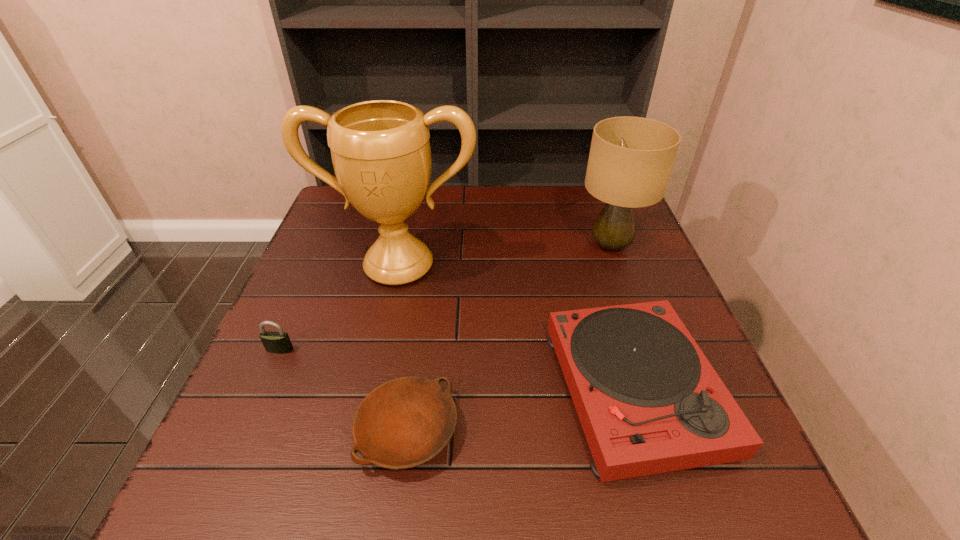
Image resolution: width=960 pixels, height=540 pixels. Identify the location of vacant space at the near edge of the desktop. (559, 511).

In the image, there is a desktop. Where is `blank space at the left edge`? The height and width of the screenshot is (540, 960). blank space at the left edge is located at coordinates (287, 382).

Locate an element on the screen. vacant area at the right edge is located at coordinates pyautogui.click(x=654, y=267).

You are a GUI agent. You are given a task and a screenshot of the screen. Output one action in this format:
    pyautogui.click(x=<x>, y=<y>)
    Task: Click on the vacant point at the far left corner
    This screenshot has height=540, width=960.
    Given the screenshot: What is the action you would take?
    pyautogui.click(x=359, y=222)

Locate an element on the screen. The width and height of the screenshot is (960, 540). vacant region at the far right corner is located at coordinates (584, 214).

At what (x,y) coordinates should I click in order to perform the action: click on free spot between the shortest object and the record player. Please return your answer as a coordinate pair (x, y). Looking at the image, I should click on (521, 410).

This screenshot has width=960, height=540. Find the location of `unoccupied area between the record player and the award`. unoccupied area between the record player and the award is located at coordinates (516, 328).

Image resolution: width=960 pixels, height=540 pixels. Identify the location of empty location between the fourth shortest object and the award. (505, 256).

You are a GUI agent. You are given a task and a screenshot of the screen. Output one action in this format:
    pyautogui.click(x=<x>, y=<y>)
    Task: Click on the free spot between the record player and the padlock
    
    Given the screenshot: What is the action you would take?
    pyautogui.click(x=457, y=370)

Identify the location of blank region between the record player and the padlock. (457, 370).